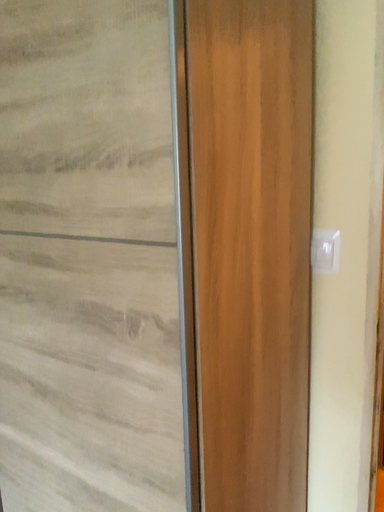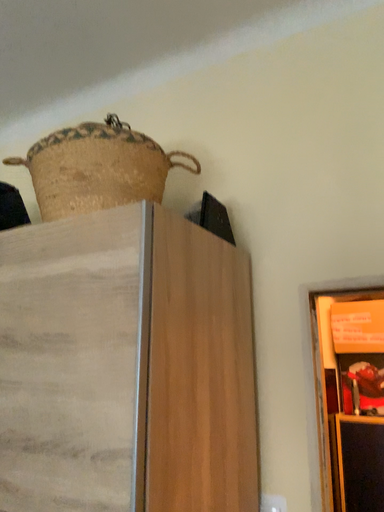
Question: How did the camera likely rotate when shooting the video?

Choices:
 (A) rotated downward
 (B) rotated upward

Answer: (B)